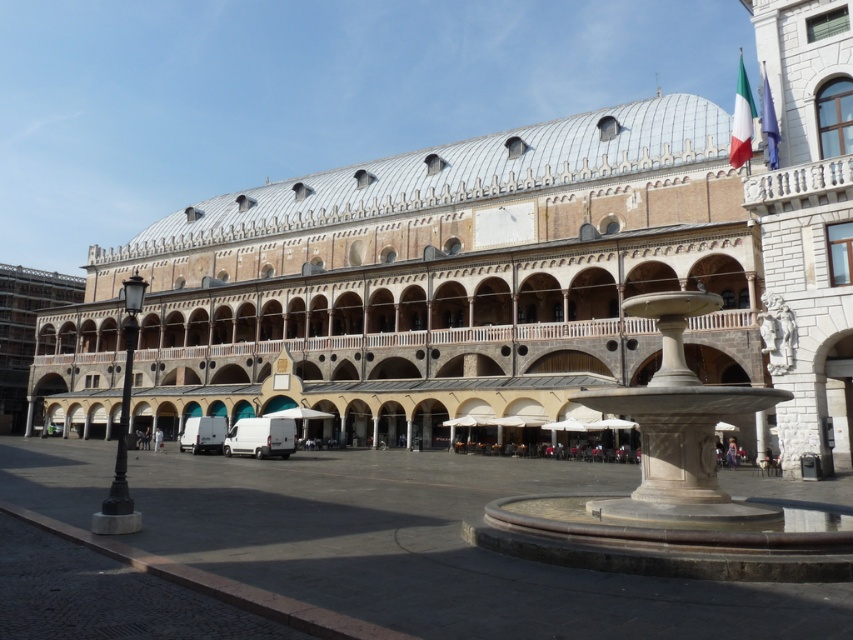
Can you confirm if beige stone palace at center is thinner than white marble fountain at center?

In fact, beige stone palace at center might be wider than white marble fountain at center.

Which of these two, beige stone palace at center or white marble fountain at center, stands taller?

With more height is beige stone palace at center.

This screenshot has width=853, height=640. Describe the element at coordinates (422, 285) in the screenshot. I see `beige stone palace at center` at that location.

Locate an element on the screen. beige stone palace at center is located at coordinates (422, 285).